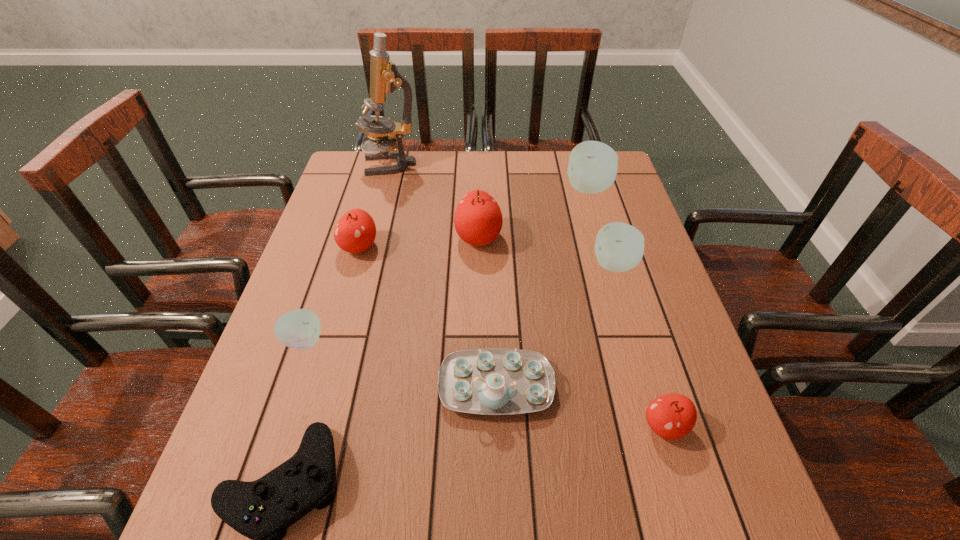
This screenshot has width=960, height=540. Identify the location of microscope. (385, 78).

Locate an element on the screen. Image resolution: width=960 pixels, height=540 pixels. the biggest white apple is located at coordinates (592, 168).

Locate an element on the screen. the farthest white apple is located at coordinates (592, 168).

Locate an element on the screen. The image size is (960, 540). the fourth apple from right to left is located at coordinates (478, 220).

Locate an element on the screen. The height and width of the screenshot is (540, 960). the second red apple from right to left is located at coordinates (478, 220).

Locate an element on the screen. This screenshot has height=540, width=960. the second farthest white apple is located at coordinates (619, 247).

You are a GUI agent. You are given a task and a screenshot of the screen. Output one action in this format:
    pyautogui.click(x=<x>, y=<y>)
    Task: Click on the leftmost red apple
    
    Given the screenshot: What is the action you would take?
    pyautogui.click(x=355, y=232)

Image resolution: width=960 pixels, height=540 pixels. What are the coordinates of `chinaware` in the screenshot? It's located at (493, 381).

Identify the location of the leftmost white apple. This screenshot has height=540, width=960. (299, 329).

Where is `the fifth farthest apple`? Image resolution: width=960 pixels, height=540 pixels. the fifth farthest apple is located at coordinates (299, 329).